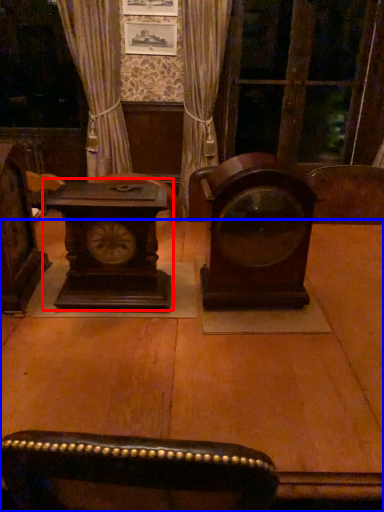
Question: Which point is further to the camera, alarm clock (highlighted by a red box) or table (highlighted by a blue box)?

Choices:
 (A) alarm clock
 (B) table

Answer: (A)